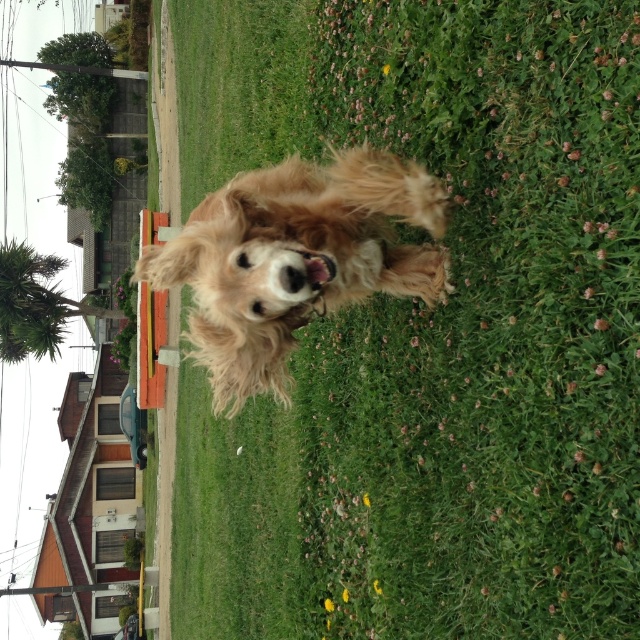
Question: Estimate the real-world distances between objects in this image. Which object is farther from the golden fur dog at center?

Choices:
 (A) green grass at center
 (B) green soft grass at center

Answer: (B)

Question: Which is nearer to the golden fur dog at center?

Choices:
 (A) green soft grass at center
 (B) green grass at center

Answer: (B)

Question: In this image, where is green grass at center located relative to green soft grass at center?

Choices:
 (A) right
 (B) left

Answer: (A)

Question: Among these points, which one is nearest to the camera?

Choices:
 (A) (180, 232)
 (B) (179, 33)

Answer: (A)

Question: Considering the relative positions of green soft grass at center and golden fur dog at center in the image provided, where is green soft grass at center located with respect to golden fur dog at center?

Choices:
 (A) above
 (B) below

Answer: (B)

Question: Is green grass at center to the right of golden fur dog at center from the viewer's perspective?

Choices:
 (A) no
 (B) yes

Answer: (B)